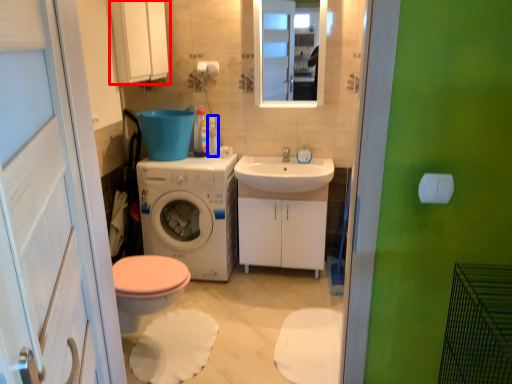
Question: Which of the following is the closest to the observer, medicine cabinet (highlighted by a red box) or toiletry (highlighted by a blue box)?

Choices:
 (A) medicine cabinet
 (B) toiletry

Answer: (A)